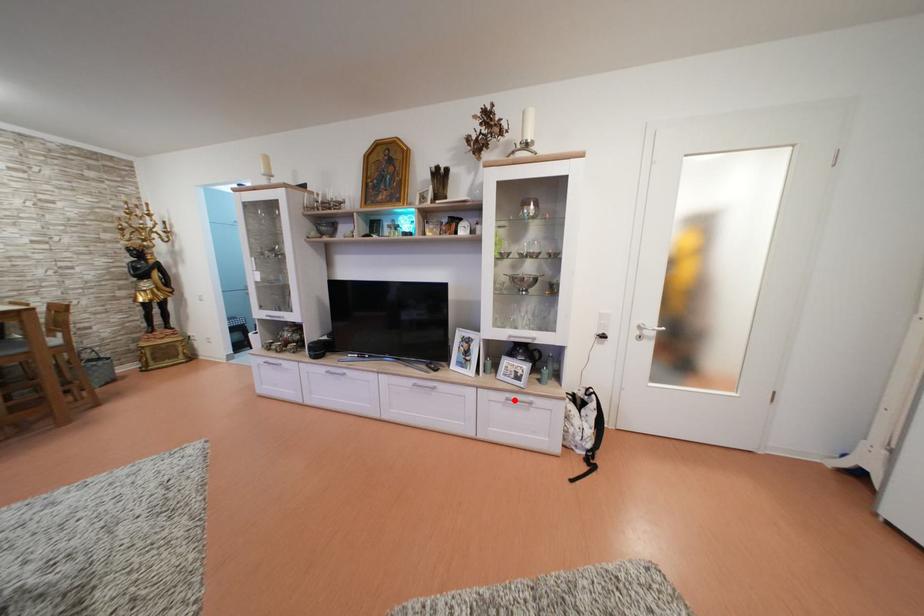
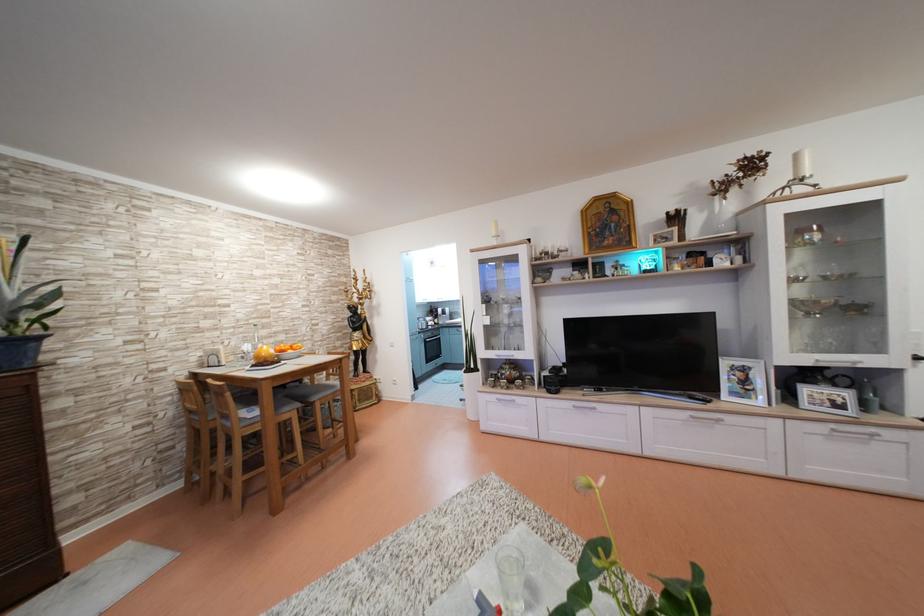
Question: I am providing you with two images of the same scene from different viewpoints. A red point is shown in image1. For the corresponding object point in image2, is it positioned nearer or farther from the camera?

Choices:
 (A) Nearer
 (B) Farther

Answer: (A)